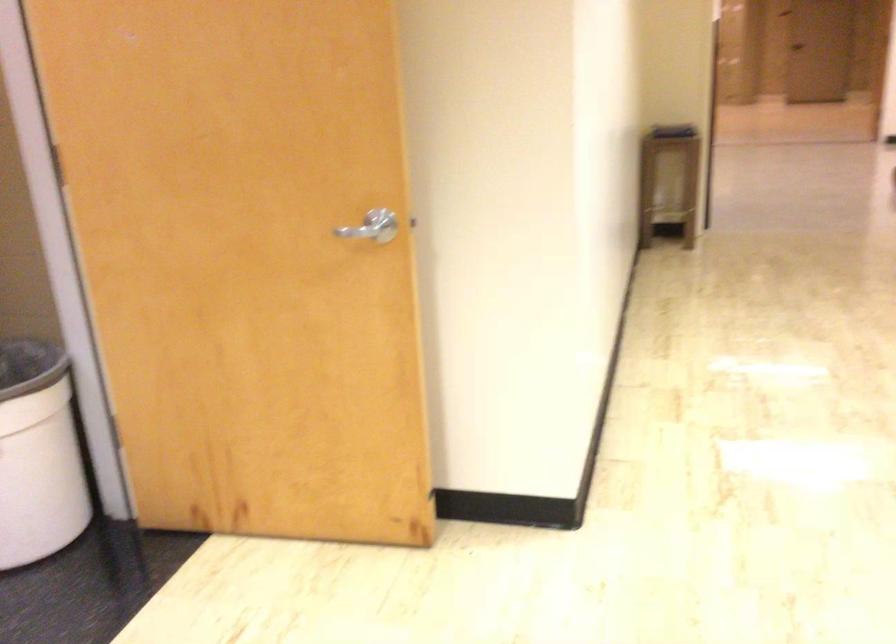
Question: Based on the continuous images, in which direction is the camera rotating? Reply with the corresponding letter.

Choices:
 (A) Left
 (B) Right
 (C) Up
 (D) Down

Answer: (B)